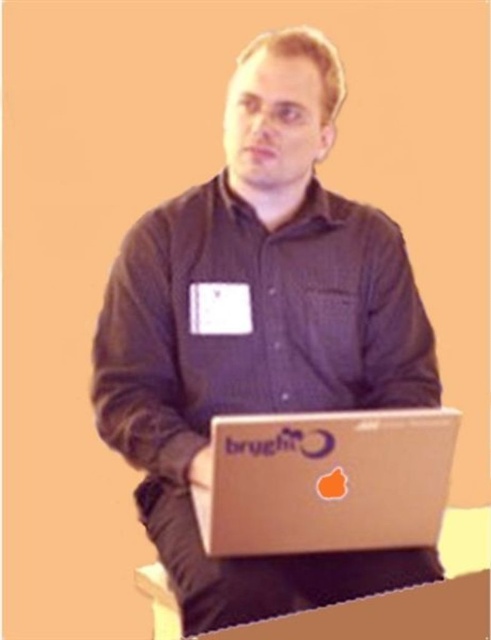
Question: Among these points, which one is nearest to the camera?

Choices:
 (A) (157, 596)
 (B) (329, 61)

Answer: (B)

Question: Where is matte black laptop at center located in relation to cardboard at lower center in the image?

Choices:
 (A) left
 (B) right

Answer: (B)

Question: Does matte black laptop at center have a greater width compared to cardboard at lower center?

Choices:
 (A) no
 (B) yes

Answer: (B)

Question: Which of these objects is positioned closest to the matte black laptop at center?

Choices:
 (A) silver metallic laptop at center
 (B) cardboard at lower center

Answer: (A)

Question: Which point is closer to the camera?

Choices:
 (A) matte black laptop at center
 (B) silver metallic laptop at center
 (C) cardboard at lower center

Answer: (B)

Question: Is matte black laptop at center further to camera compared to cardboard at lower center?

Choices:
 (A) yes
 (B) no

Answer: (B)